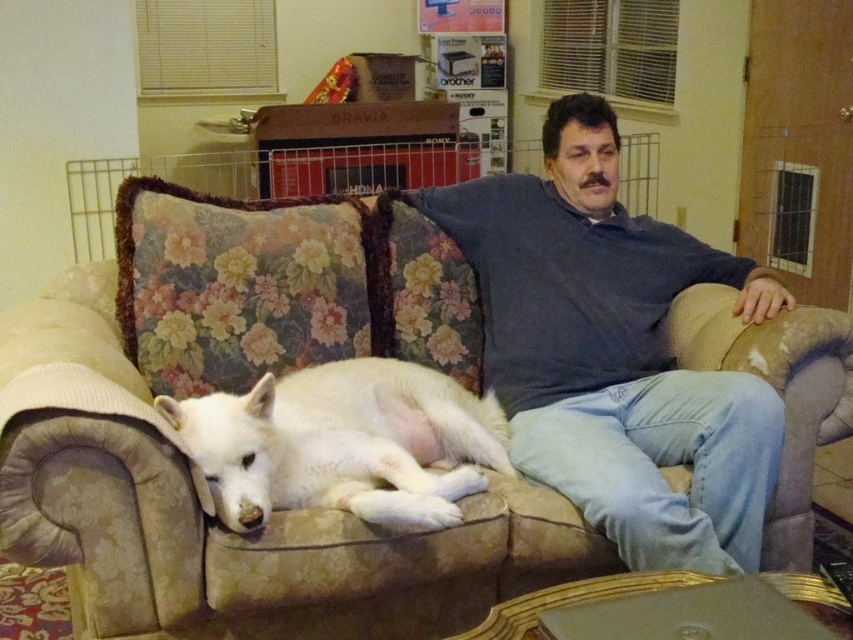
Does beige floral couch at center have a smaller size compared to white fur dog at center?

No.

Can you confirm if beige floral couch at center is shorter than white fur dog at center?

No, beige floral couch at center is not shorter than white fur dog at center.

Identify the location of beige floral couch at center. (242, 388).

Measure the distance between blue cotton shirt at center and camera.

1.62 meters

Based on the photo, can you confirm if blue cotton shirt at center is wider than white fur dog at center?

Correct, the width of blue cotton shirt at center exceeds that of white fur dog at center.

Between point (578, 388) and point (415, 502), which one is positioned in front?

Point (415, 502) is more forward.

Locate an element on the screen. Image resolution: width=853 pixels, height=640 pixels. blue cotton shirt at center is located at coordinates (614, 352).

Between point (788, 372) and point (689, 260), which one is positioned behind?

The point (689, 260) is behind.

Who is taller, beige floral couch at center or blue cotton shirt at center?

blue cotton shirt at center

Between point (50, 472) and point (540, 195), which one is positioned in front?

Point (50, 472)

Where is `beige floral couch at center`? The width and height of the screenshot is (853, 640). beige floral couch at center is located at coordinates (242, 388).